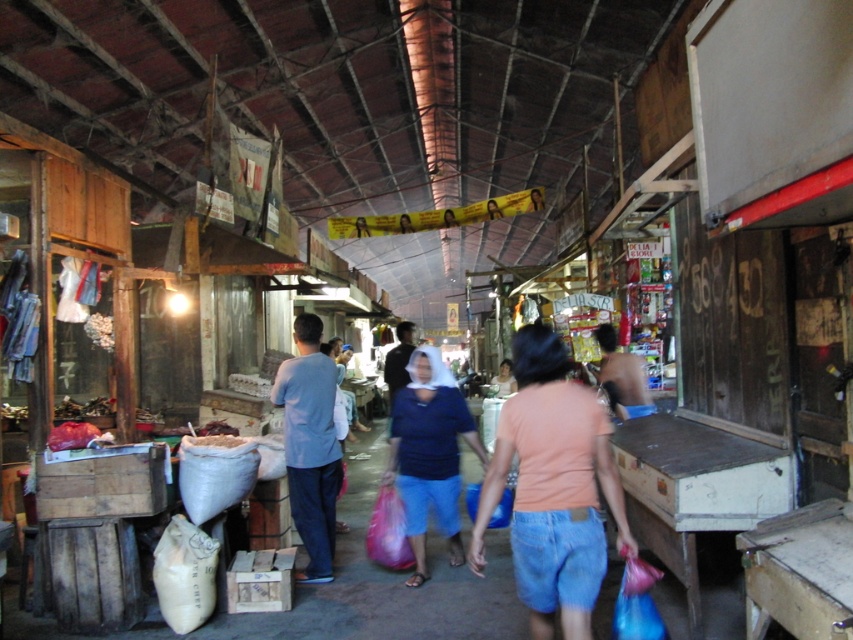
Question: Does denim shorts at center have a smaller size compared to blue cotton shirt at center?

Choices:
 (A) yes
 (B) no

Answer: (A)

Question: Can you confirm if denim shorts at center is smaller than light blue fabric shirt at center?

Choices:
 (A) yes
 (B) no

Answer: (B)

Question: Which point is farther from the camera taking this photo?

Choices:
 (A) (306, 525)
 (B) (445, 426)

Answer: (A)

Question: Which of the following is the farthest from the observer?

Choices:
 (A) (318, 552)
 (B) (590, 492)
 (C) (405, 502)

Answer: (A)

Question: Among these points, which one is nearest to the camera?

Choices:
 (A) (434, 403)
 (B) (547, 595)
 (C) (308, 502)

Answer: (B)

Question: Is blue cotton shirt at center positioned in front of light blue fabric shirt at center?

Choices:
 (A) yes
 (B) no

Answer: (A)